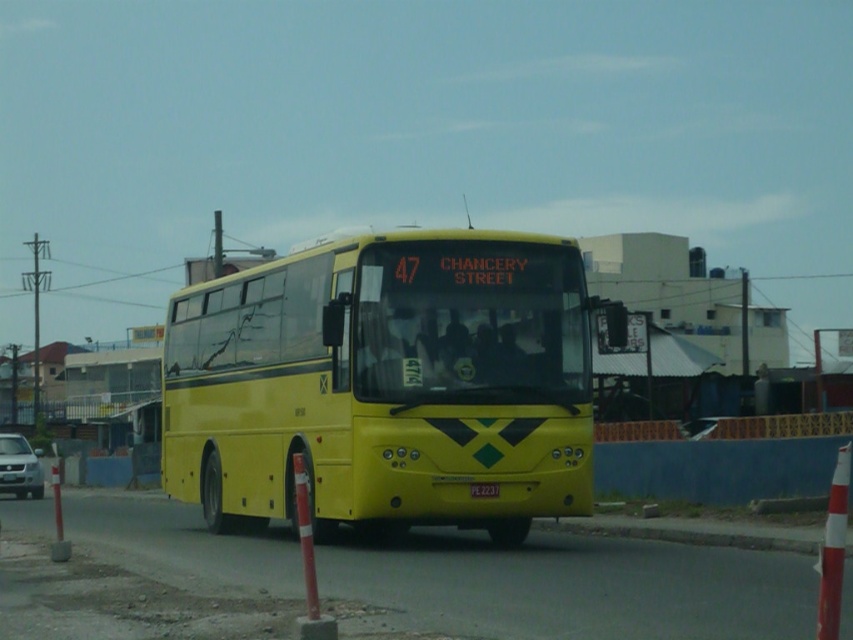
Question: Is silver metallic car at lower left below black plastic license plate at center?

Choices:
 (A) no
 (B) yes

Answer: (B)

Question: Estimate the real-world distances between objects in this image. Which object is closer to the yellow matte bus at center?

Choices:
 (A) black plastic license plate at center
 (B) silver metallic car at lower left

Answer: (A)

Question: Which point appears closest to the camera in this image?

Choices:
 (A) (42, 493)
 (B) (469, 490)

Answer: (B)

Question: Where is silver metallic car at lower left located in relation to black plastic license plate at center in the image?

Choices:
 (A) below
 (B) above

Answer: (A)

Question: Which object is the closest to the yellow matte bus at center?

Choices:
 (A) black plastic license plate at center
 (B) silver metallic car at lower left

Answer: (A)

Question: Is yellow matte bus at center positioned behind silver metallic car at lower left?

Choices:
 (A) no
 (B) yes

Answer: (A)